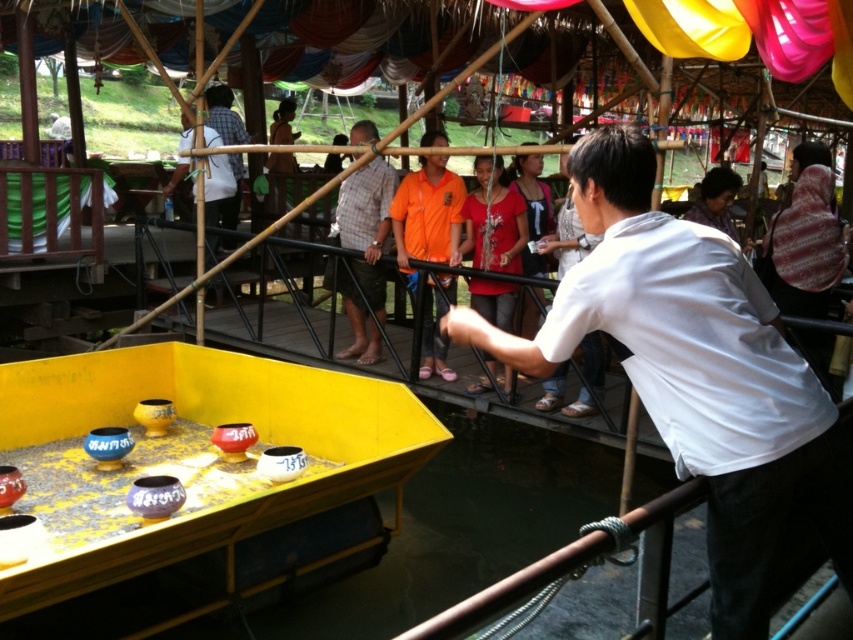
Is orange jersey at center thinner than orange fabric shirt at center?

Incorrect, orange jersey at center's width is not less than orange fabric shirt at center's.

Can you confirm if orange jersey at center is shorter than orange fabric shirt at center?

In fact, orange jersey at center may be taller than orange fabric shirt at center.

You are a GUI agent. You are given a task and a screenshot of the screen. Output one action in this format:
    pyautogui.click(x=<x>, y=<y>)
    Task: Click on the orange jersey at center
    
    Given the screenshot: What is the action you would take?
    pyautogui.click(x=427, y=218)

Locate an element on the screen. This screenshot has height=640, width=853. orange jersey at center is located at coordinates (427, 218).

In the scene shown: Is plaid fabric shirt at center thinner than orange fabric shirt at center?

No, plaid fabric shirt at center is not thinner than orange fabric shirt at center.

Identify the location of plaid fabric shirt at center. (364, 252).

The height and width of the screenshot is (640, 853). What do you see at coordinates (364, 252) in the screenshot? I see `plaid fabric shirt at center` at bounding box center [364, 252].

At what (x,y) coordinates should I click in order to perform the action: click on plaid fabric shirt at center. Please return your answer as a coordinate pair (x, y). The image size is (853, 640). Looking at the image, I should click on (364, 252).

Can you confirm if white matte shirt at center is positioned to the left of orange jersey at center?

In fact, white matte shirt at center is to the right of orange jersey at center.

Who is positioned more to the left, white matte shirt at center or orange jersey at center?

From the viewer's perspective, orange jersey at center appears more on the left side.

Locate an element on the screen. The image size is (853, 640). white matte shirt at center is located at coordinates click(x=695, y=372).